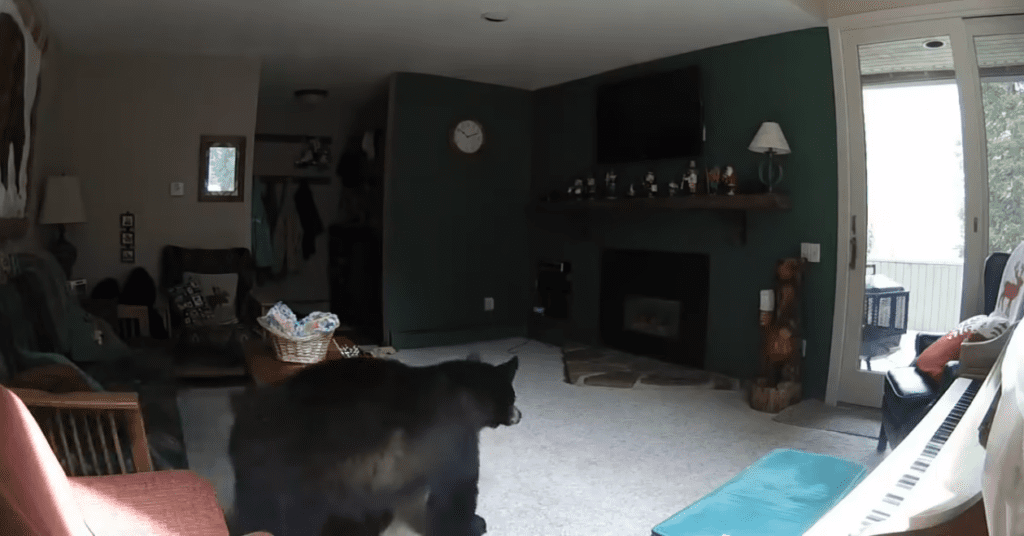
Find the location of a particular element. This screenshot has width=1024, height=536. piano is located at coordinates (924, 451).